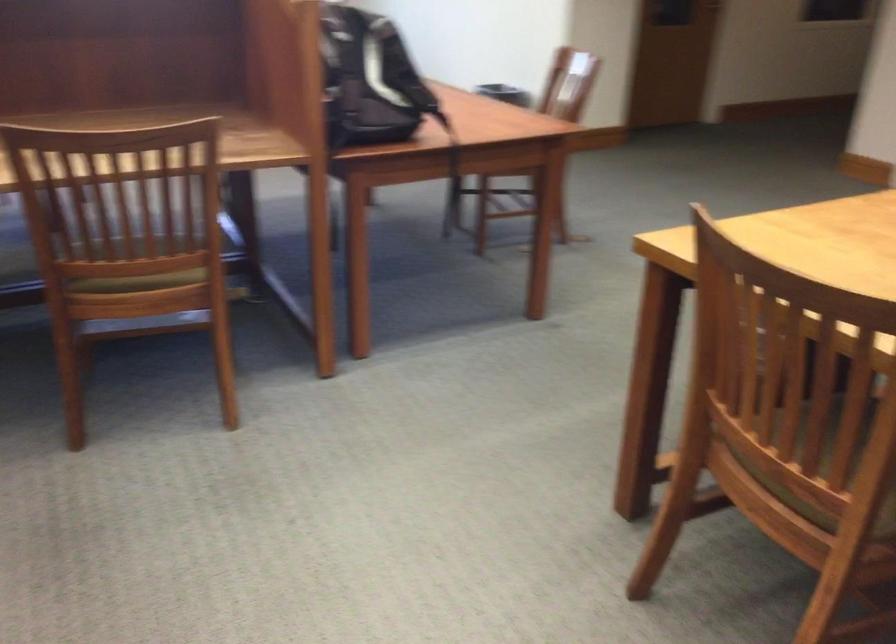
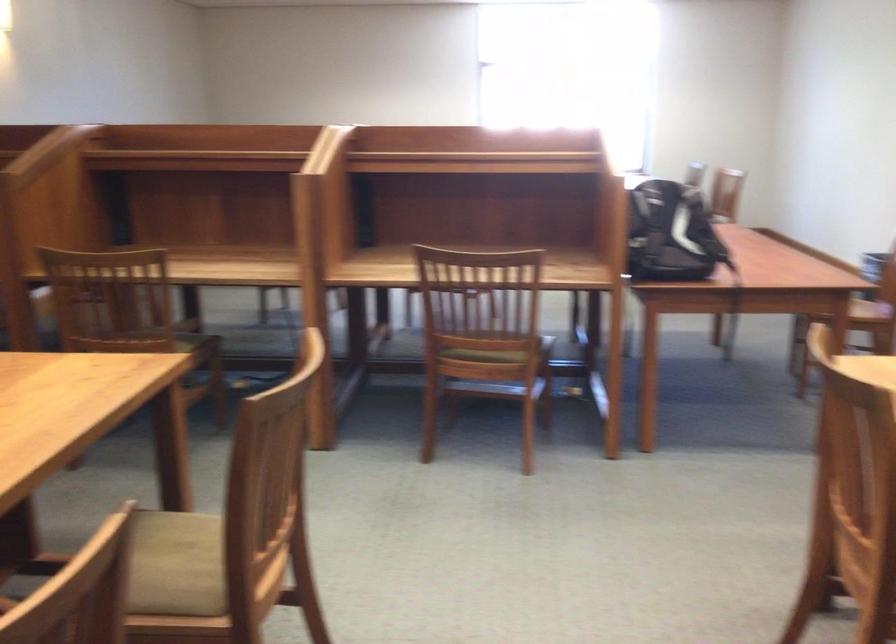
Question: The camera is either moving clockwise (left) or counter-clockwise (right) around the object. The first image is from the beginning of the video and the second image is from the end. Is the camera moving left or right when shooting the video?

Choices:
 (A) Left
 (B) Right

Answer: (B)